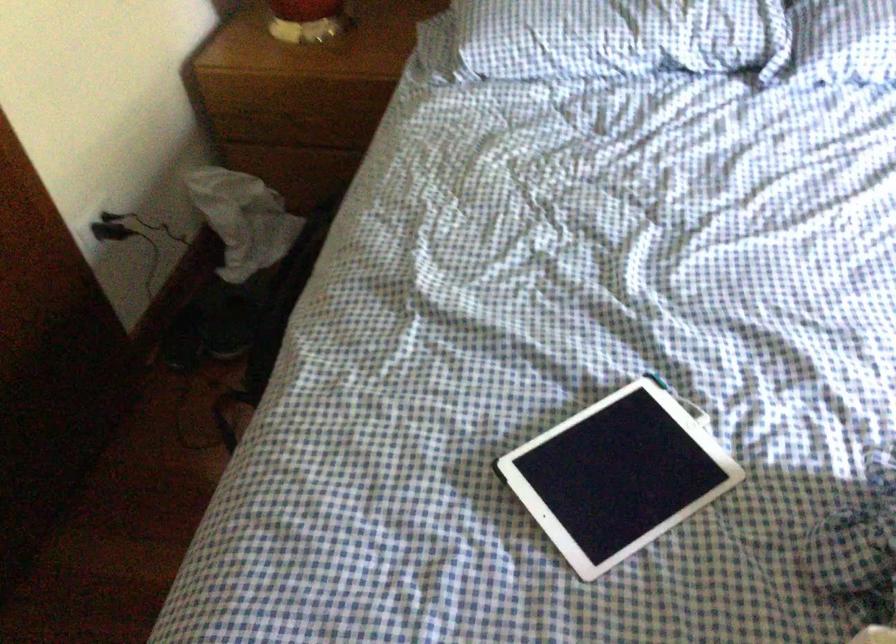
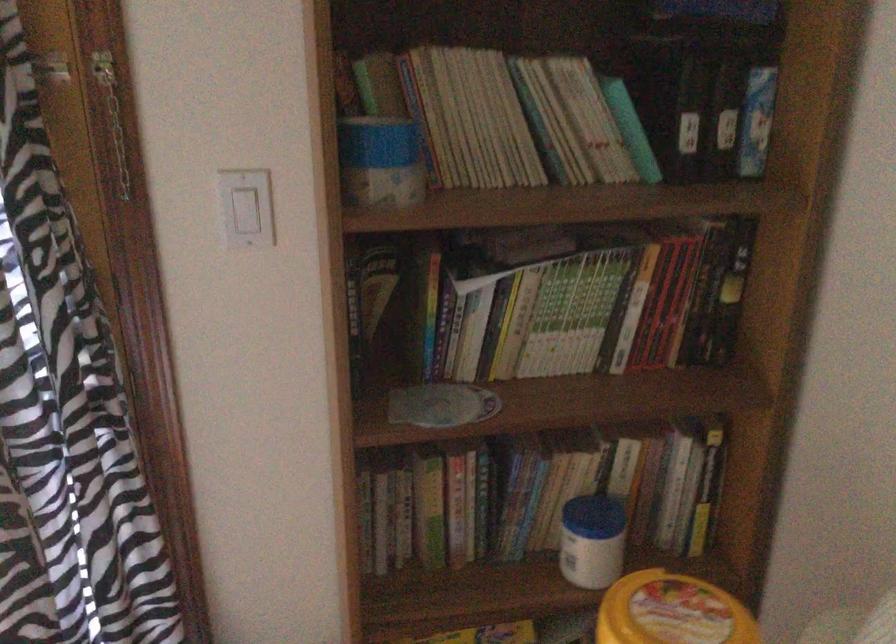
The images are taken continuously from a first-person perspective. In which direction is your viewpoint rotating?

The camera's rotation is toward right-down.